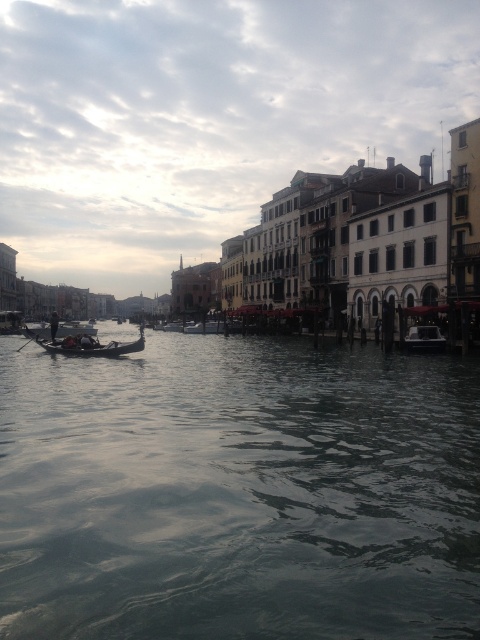
Question: Which object is closer to the camera taking this photo?

Choices:
 (A) dark blue fabric person at left
 (B) black wood paddle at lower left
 (C) wooden gondola at center

Answer: (C)

Question: Is dark gray water at center behind black wood paddle at lower left?

Choices:
 (A) yes
 (B) no

Answer: (B)

Question: Is black wood paddle at lower left in front of dark blue fabric person at left?

Choices:
 (A) no
 (B) yes

Answer: (B)

Question: Which point is closer to the camera?

Choices:
 (A) dark gray water at center
 (B) black wood paddle at lower left

Answer: (A)

Question: Among these objects, which one is farthest from the camera?

Choices:
 (A) wooden gondola at center
 (B) black wood paddle at lower left
 (C) dark blue fabric person at left

Answer: (C)

Question: Does dark gray water at center have a larger size compared to dark blue fabric person at left?

Choices:
 (A) no
 (B) yes

Answer: (A)